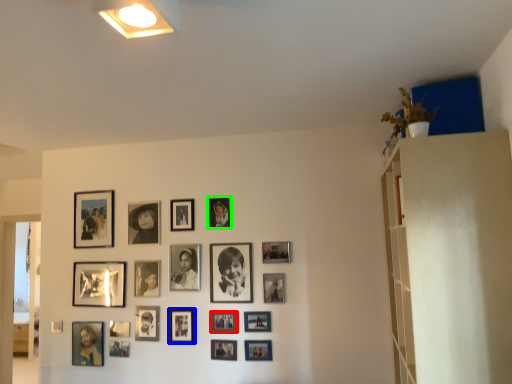
Question: Which is nearer to the picture frame (highlighted by a red box)? picture frame (highlighted by a blue box) or picture frame (highlighted by a green box).

Choices:
 (A) picture frame
 (B) picture frame

Answer: (A)